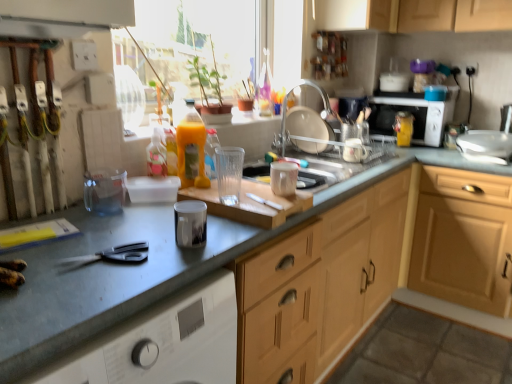
Locate an element on the screen. free location in front of white ceramic mug at upper center, marked as the fifth appliance in a front-to-back arrangement is located at coordinates (374, 154).